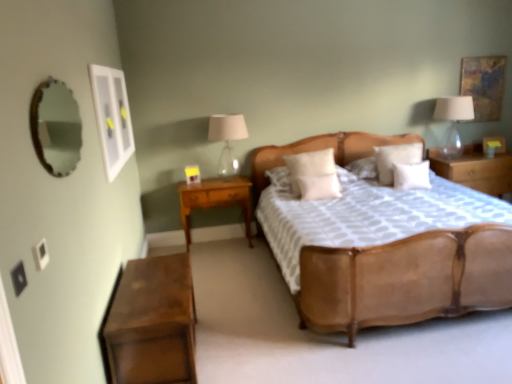
Question: Is translucent glass lampshade at right, which is counted as the 2th bedside lamp, starting from the left, directly adjacent to white soft pillow at center, the third pillow viewed from the right?

Choices:
 (A) yes
 (B) no

Answer: (B)

Question: Is translucent glass lampshade at right, which is counted as the 1th bedside lamp, starting from the right, thinner than white soft pillow at center, the third pillow viewed from the right?

Choices:
 (A) yes
 (B) no

Answer: (B)

Question: Would you consider translucent glass lampshade at right, which is counted as the 2th bedside lamp, starting from the left, to be distant from white soft pillow at center, arranged as the 2th pillow when viewed from the left?

Choices:
 (A) yes
 (B) no

Answer: (A)

Question: Does translucent glass lampshade at right, which is counted as the 2th bedside lamp, starting from the left, have a greater width compared to white soft pillow at center, the third pillow viewed from the right?

Choices:
 (A) yes
 (B) no

Answer: (A)

Question: Does translucent glass lampshade at right, which is counted as the 2th bedside lamp, starting from the left, come behind white soft pillow at center, the third pillow viewed from the right?

Choices:
 (A) no
 (B) yes

Answer: (B)

Question: Is point tap(325, 317) positioned closer to the camera than point tap(221, 163)?

Choices:
 (A) farther
 (B) closer

Answer: (B)

Question: Based on their positions, is leather bed at center located to the left or right of matte glass lampshade at center, the first bedside lamp viewed from the left?

Choices:
 (A) left
 (B) right

Answer: (B)

Question: Is leather bed at center wider or thinner than matte glass lampshade at center, the second bedside lamp in the right-to-left sequence?

Choices:
 (A) wide
 (B) thin

Answer: (A)

Question: From a real-world perspective, is leather bed at center physically located above or below matte glass lampshade at center, the first bedside lamp viewed from the left?

Choices:
 (A) below
 (B) above

Answer: (A)

Question: Visually, is light wood/wooden nightstand at lower left, the second nightstand when ordered from back to front, positioned to the left or to the right of white soft pillow at center, placed as the 3th pillow when sorted from left to right?

Choices:
 (A) left
 (B) right

Answer: (A)

Question: In the image, is light wood/wooden nightstand at lower left, positioned as the 2th nightstand in left-to-right order, positioned in front of or behind white soft pillow at center, placed as the 3th pillow when sorted from left to right?

Choices:
 (A) front
 (B) behind

Answer: (B)

Question: In terms of width, does light wood/wooden nightstand at lower left, positioned as the 2th nightstand in left-to-right order, look wider or thinner when compared to white soft pillow at center, marked as the 2th pillow in a right-to-left arrangement?

Choices:
 (A) thin
 (B) wide

Answer: (B)

Question: In terms of size, does light wood/wooden nightstand at lower left, the 2th nightstand viewed from the front, appear bigger or smaller than white soft pillow at center, placed as the 3th pillow when sorted from left to right?

Choices:
 (A) big
 (B) small

Answer: (A)

Question: Which is correct: textured canvas painting at upper right, the 1th picture frame when ordered from back to front, is inside white soft pillow at center, the fourth pillow in the right-to-left sequence, or outside of it?

Choices:
 (A) inside
 (B) outside

Answer: (B)

Question: In terms of height, does textured canvas painting at upper right, which is counted as the 2th picture frame, starting from the bottom, look taller or shorter compared to white soft pillow at center, which ranks as the 1th pillow in left-to-right order?

Choices:
 (A) tall
 (B) short

Answer: (A)